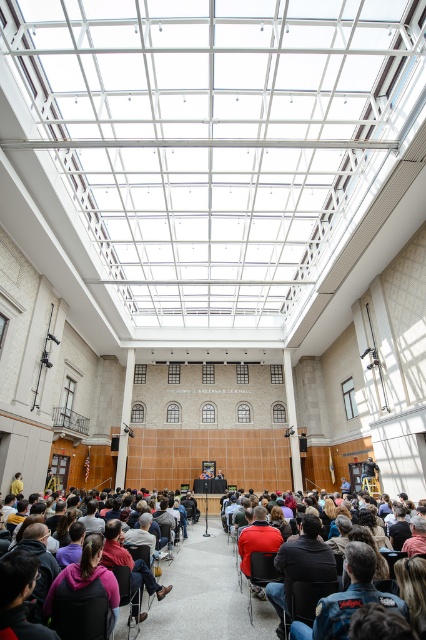
What is the exact location of the dark gray fabric jacket at lower center in the image?

The dark gray fabric jacket at lower center is located at point (129, 561).

You are attending a presentation and notice two items on the stage. The first is a dark gray fabric jacket at lower center, and the second is a matte red shirt at center. Which item is positioned lower in the stage setup?

The dark gray fabric jacket at lower center is positioned lower than the matte red shirt at center according to the description.

You are an event organizer who needs to ensure that the speaker is visible to the audience. Given the current setup with the matte red shirt at center and the matte black chair at center, which object should you focus on adjusting to improve visibility?

The matte red shirt at center is larger in size than the matte black chair at center, so adjusting the matte red shirt at center would be more effective in improving visibility since it is the larger object.